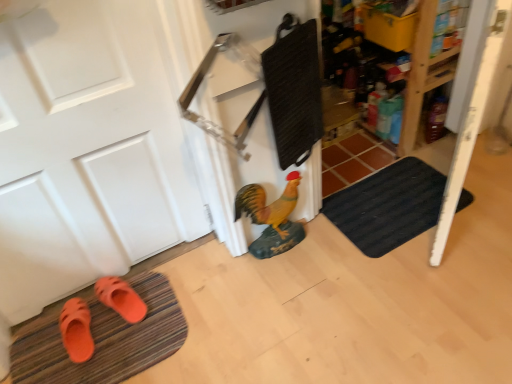
Question: In the image, is orange rubber bath mat at lower left, the first bath mat in the bottom-to-top sequence, positioned in front of or behind white matte door at left?

Choices:
 (A) behind
 (B) front

Answer: (A)

Question: From a real-world perspective, relative to white matte door at left, is orange rubber bath mat at lower left, which appears as the second bath mat when viewed from the top, vertically above or below?

Choices:
 (A) below
 (B) above

Answer: (A)

Question: Which object is the farthest from the orange rubber sandals at lower left, the 2th footwear viewed from the right?

Choices:
 (A) orange rubber slipper at lower left, arranged as the 1th footwear when viewed from the right
 (B) black textured bath mat at lower right, the second bath mat positioned from the left
 (C) shiny yellow chicken at center
 (D) orange rubber bath mat at lower left, the 1th bath mat in the left-to-right sequence
 (E) white matte door at left

Answer: (B)

Question: Based on their relative distances, which object is nearer to the orange rubber sandals at lower left, the first footwear viewed from the left?

Choices:
 (A) orange rubber slipper at lower left, arranged as the 1th footwear when viewed from the right
 (B) white matte door at left
 (C) shiny yellow chicken at center
 (D) orange rubber bath mat at lower left, the 1th bath mat in the left-to-right sequence
 (E) black textured bath mat at lower right, marked as the 2th bath mat in a bottom-to-top arrangement

Answer: (D)